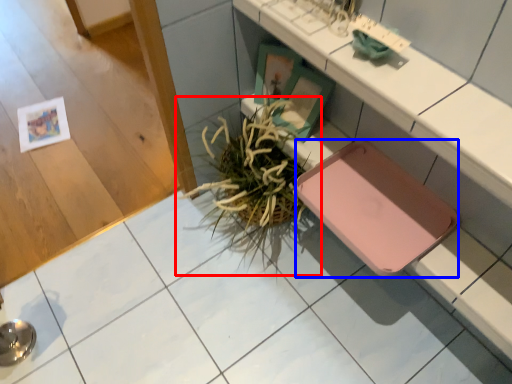
Question: Which of the following is the farthest to the observer, houseplant (highlighted by a red box) or pad (highlighted by a blue box)?

Choices:
 (A) houseplant
 (B) pad

Answer: (A)